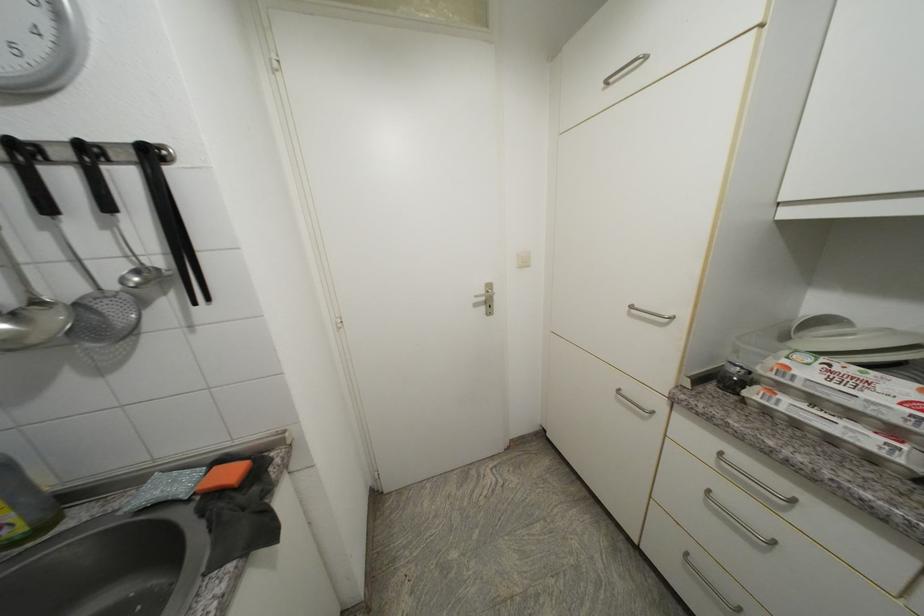
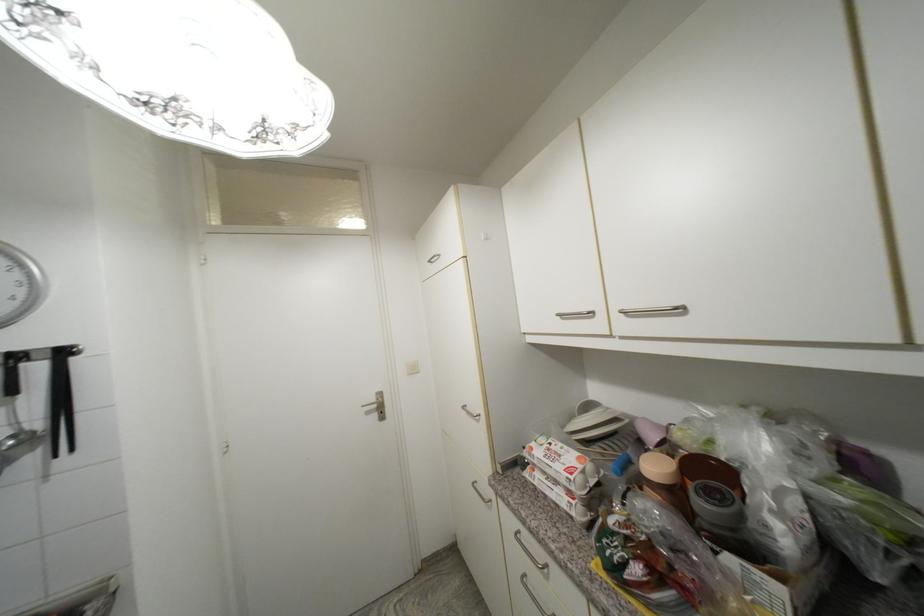
Where in the second image is the point corresponding to pixel 786 410 from the first image?

(541, 485)